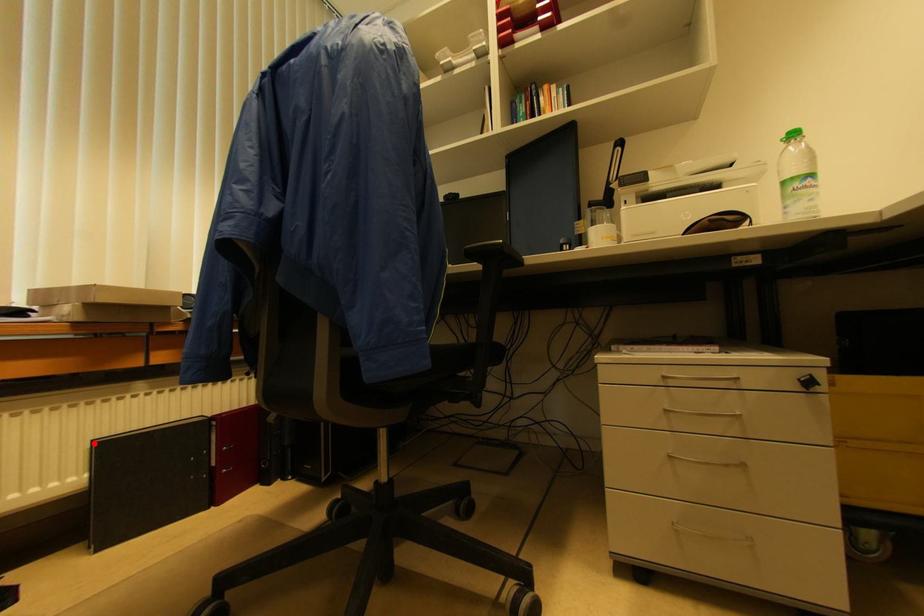
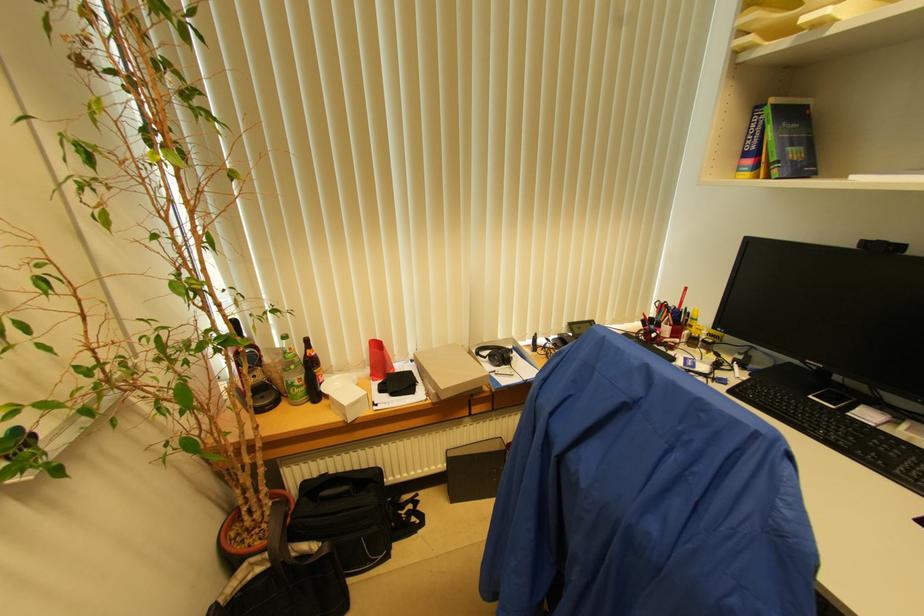
Where in the second image is the point corresponding to the highlighted location from the first image?

(447, 453)